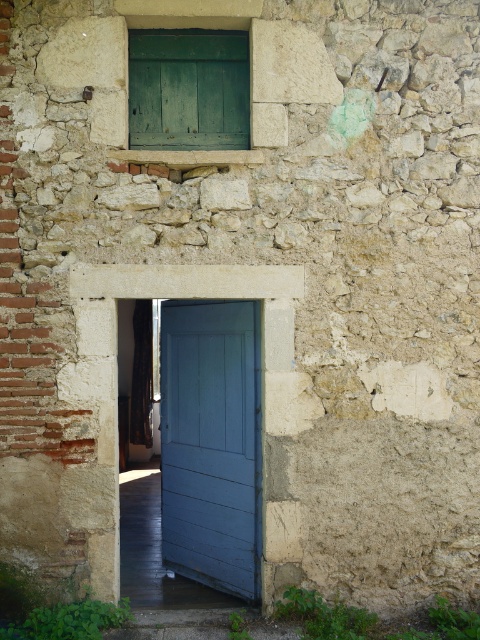
Question: Can you confirm if blue wooden door at center is positioned to the right of green wooden window at upper center?

Choices:
 (A) no
 (B) yes

Answer: (B)

Question: Does blue wooden door at center appear on the left side of green wooden window at upper center?

Choices:
 (A) yes
 (B) no

Answer: (B)

Question: Does blue wooden door at center appear over green wooden window at upper center?

Choices:
 (A) no
 (B) yes

Answer: (A)

Question: Which point is farther from the camera taking this photo?

Choices:
 (A) (201, 493)
 (B) (239, 99)

Answer: (A)